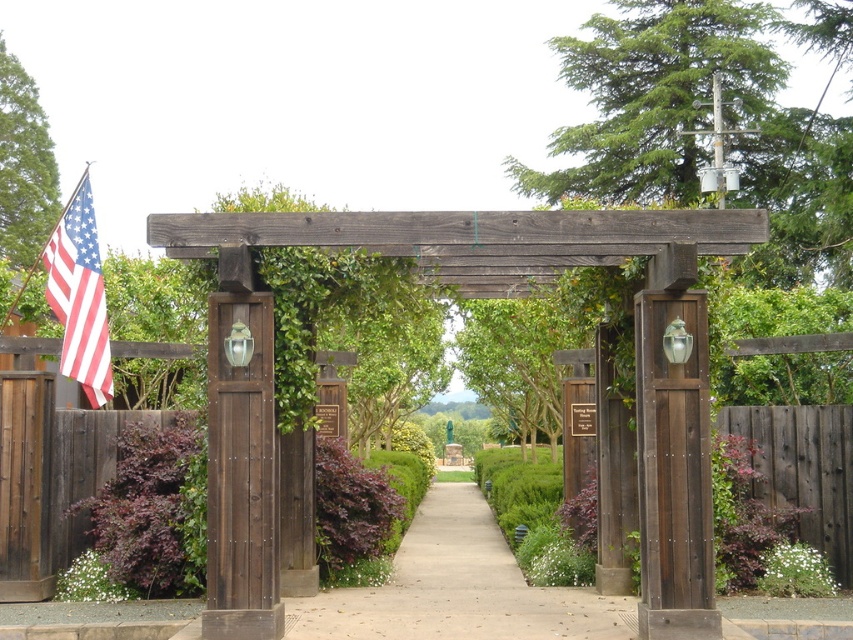
You are standing in a garden and see the dark brown wood pergola at center and the american flag at left. Which object is closer to you?

The dark brown wood pergola at center is closer to you because it is in front of the american flag at left.

You are standing at the entrance of the garden and see the rustic wood post at center and the metallic flagpole at upper left. Which object is closer to the ground?

The rustic wood post at center is positioned under the metallic flagpole at upper left, so it is closer to the ground.

You are standing at the entrance of a garden and see the dark brown wood pergola at center and the american flag at left. If you want to walk from the flag to the pergola, how many steps would you need to take if each step covers 3 feet?

The distance between the dark brown wood pergola at center and the american flag at left is 13.51 feet. Since each step covers 3 feet, you would need approximately 5 steps to reach the pergola from the flag.